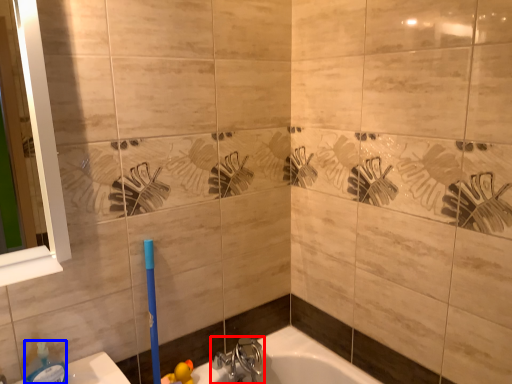
Question: Which object appears farthest to the camera in this image, tap (highlighted by a red box) or soap dispenser (highlighted by a blue box)?

Choices:
 (A) tap
 (B) soap dispenser

Answer: (A)